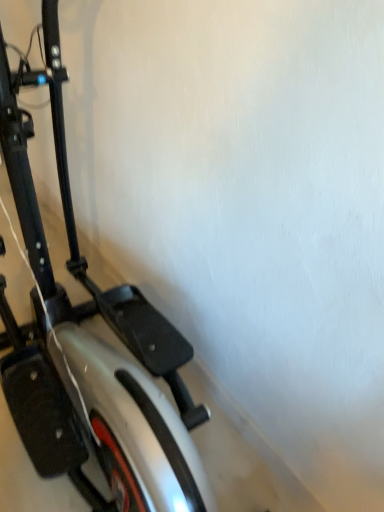
This screenshot has width=384, height=512. Describe the element at coordinates (90, 344) in the screenshot. I see `silver metallic stationary bicycle at left` at that location.

Find the location of a particular element. silver metallic stationary bicycle at left is located at coordinates (90, 344).

Image resolution: width=384 pixels, height=512 pixels. I want to click on silver metallic stationary bicycle at left, so [x=90, y=344].